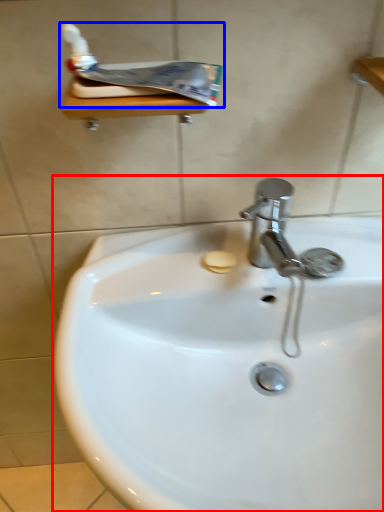
Question: Which object is closer to the camera taking this photo, sink (highlighted by a red box) or toothpaste (highlighted by a blue box)?

Choices:
 (A) sink
 (B) toothpaste

Answer: (A)